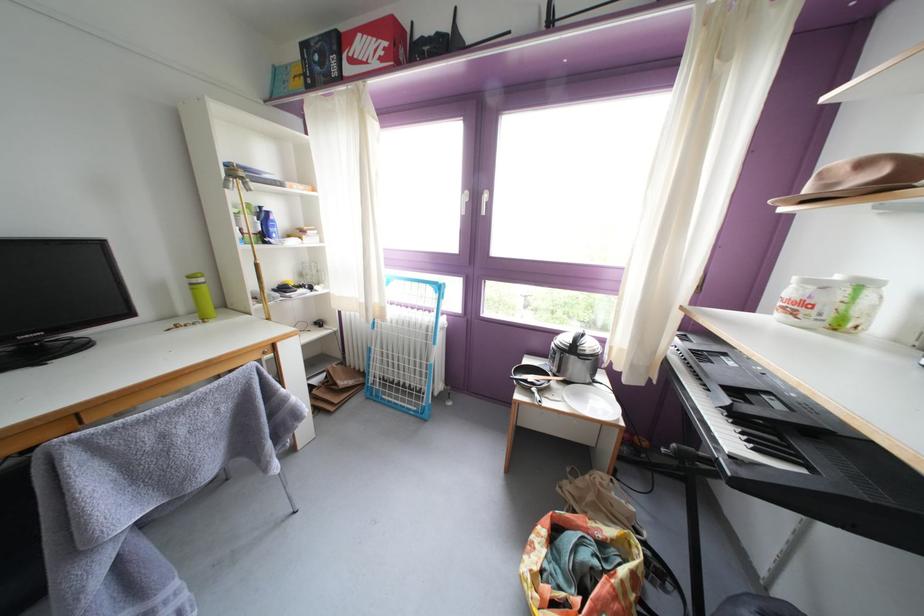
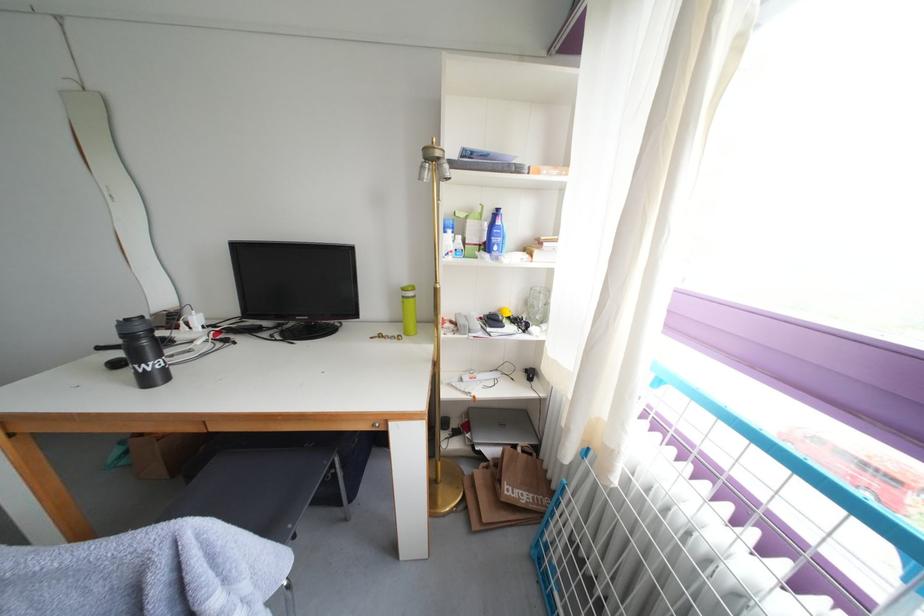
In the second image, find the point that corresponds to point 200,284 in the first image.

(414, 294)